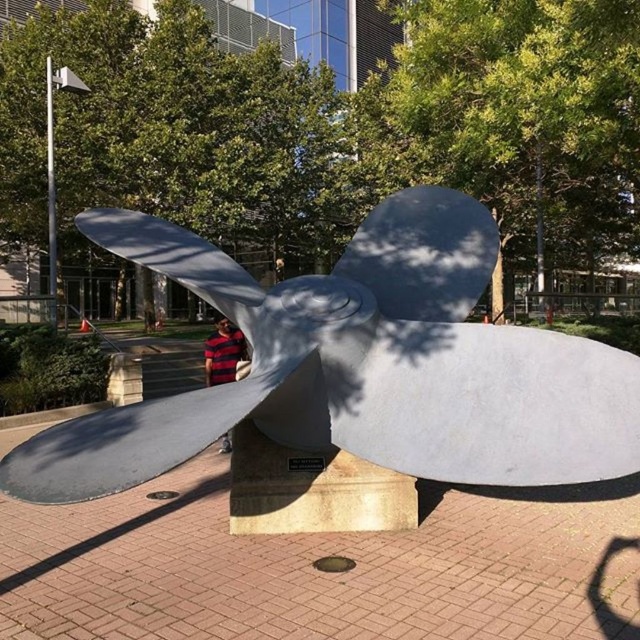
You are an artist planning to paint the scene. You want to focus on the satin silver propeller at center and the striped fabric at center. Which object should you paint larger to accurately represent their sizes in the image?

The striped fabric at center should be painted larger than the satin silver propeller at center since the satin silver propeller at center is smaller than striped fabric at center according to the description.

You are standing in front of the propeller sculpture and want to place a small decoration on the striped fabric at center. Can you place it without touching the satin silver propeller at center?

The satin silver propeller at center is above the striped fabric at center, so yes, you can place the decoration on the striped fabric at center without touching the propeller as long as you position it carefully below the propeller.